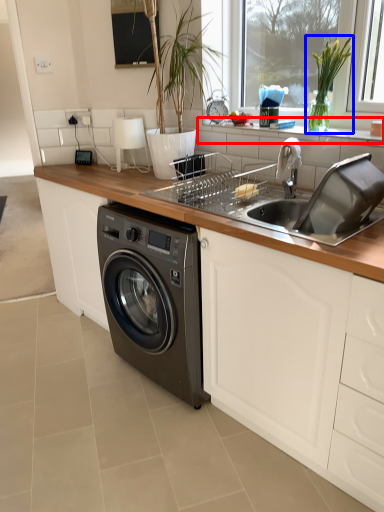
Question: Which object appears farthest to the camera in this image, window sill (highlighted by a red box) or plant (highlighted by a blue box)?

Choices:
 (A) window sill
 (B) plant

Answer: (B)